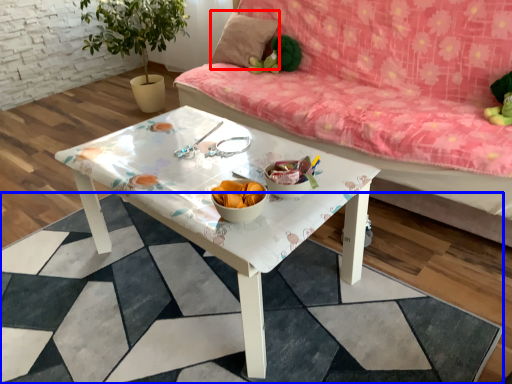
Question: Which of the following is the closest to the observer, pillow (highlighted by a red box) or square (highlighted by a blue box)?

Choices:
 (A) pillow
 (B) square

Answer: (B)